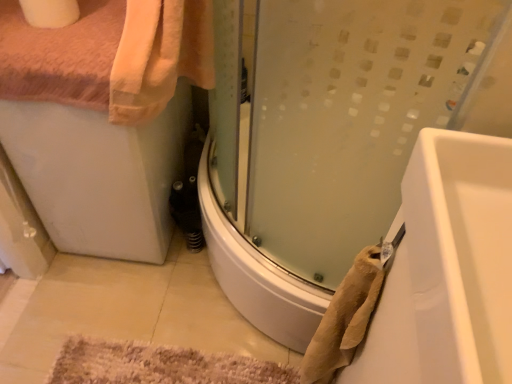
Locate an element on the screen. This screenshot has width=512, height=384. free space to the left of beige textured bath mat at lower center is located at coordinates (66, 311).